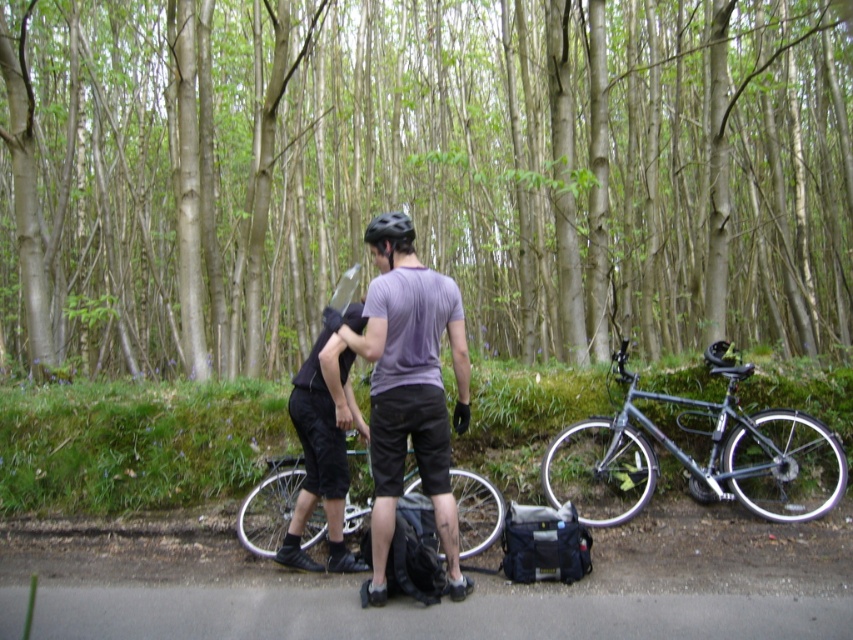
Is silver metallic bicycle at center to the right of black matte helmet at center from the viewer's perspective?

In fact, silver metallic bicycle at center is to the left of black matte helmet at center.

Who is shorter, silver metallic bicycle at center or black matte helmet at center?

Standing shorter between the two is black matte helmet at center.

Is point (466, 529) behind point (407, 220)?

Yes, point (466, 529) is behind point (407, 220).

At what (x,y) coordinates should I click in order to perform the action: click on silver metallic bicycle at center. Please return your answer as a coordinate pair (x, y). This screenshot has height=640, width=853. Looking at the image, I should click on (270, 506).

Does green leafy tree at center have a smaller size compared to matte purple t-shirt at center?

Incorrect, green leafy tree at center is not smaller in size than matte purple t-shirt at center.

The image size is (853, 640). Describe the element at coordinates (421, 173) in the screenshot. I see `green leafy tree at center` at that location.

Does point (784, 141) lie behind point (373, 230)?

Yes.

I want to click on green leafy tree at center, so click(421, 173).

Does matte purple t-shirt at center have a lesser width compared to black matte helmet at center?

No.

What do you see at coordinates (409, 388) in the screenshot?
I see `matte purple t-shirt at center` at bounding box center [409, 388].

At what (x,y) coordinates should I click in order to perform the action: click on matte purple t-shirt at center. Please return your answer as a coordinate pair (x, y). This screenshot has height=640, width=853. Looking at the image, I should click on (409, 388).